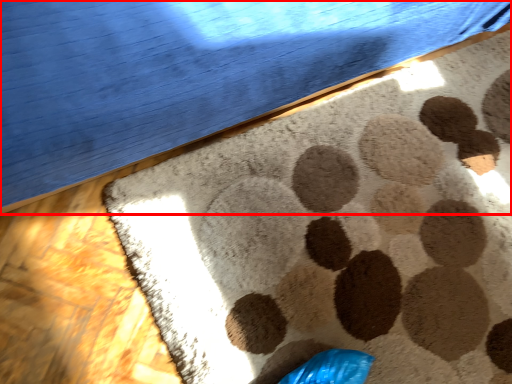
Question: From the image's perspective, considering the relative positions of furniture (annotated by the red box) and mat in the image provided, where is furniture (annotated by the red box) located with respect to the staircase?

Choices:
 (A) above
 (B) below

Answer: (A)